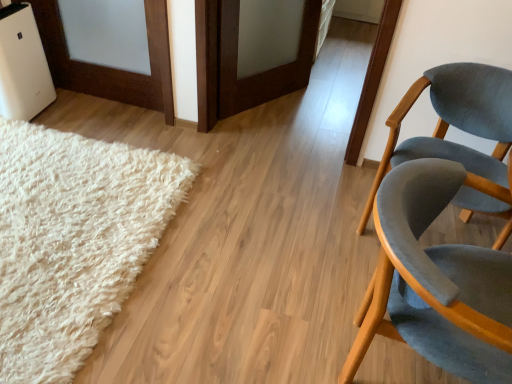
Question: From the image's perspective, does matte gray chair at right, the first chair when ordered from back to front, appear lower than velvet grey chair at right, which is the 1th chair in front-to-back order?

Choices:
 (A) no
 (B) yes

Answer: (A)

Question: Can you confirm if matte gray chair at right, placed as the 2th chair when sorted from front to back, is bigger than velvet grey chair at right, which is counted as the 2th chair, starting from the back?

Choices:
 (A) no
 (B) yes

Answer: (A)

Question: Is matte gray chair at right, placed as the 2th chair when sorted from front to back, facing towards velvet grey chair at right, which is counted as the 2th chair, starting from the back?

Choices:
 (A) no
 (B) yes

Answer: (B)

Question: Can you confirm if matte gray chair at right, placed as the 2th chair when sorted from front to back, is thinner than velvet grey chair at right, which is counted as the 2th chair, starting from the back?

Choices:
 (A) yes
 (B) no

Answer: (B)

Question: Is matte gray chair at right, placed as the 2th chair when sorted from front to back, smaller than velvet grey chair at right, which is the 1th chair in front-to-back order?

Choices:
 (A) yes
 (B) no

Answer: (A)

Question: Is matte gray chair at right, the first chair when ordered from back to front, taller than velvet grey chair at right, which is the 1th chair in front-to-back order?

Choices:
 (A) yes
 (B) no

Answer: (A)

Question: Is velvet grey chair at right, which is counted as the 2th chair, starting from the back, outside white fluffy rug at lower left?

Choices:
 (A) no
 (B) yes

Answer: (B)

Question: Is velvet grey chair at right, which is the 1th chair in front-to-back order, positioned behind white fluffy rug at lower left?

Choices:
 (A) no
 (B) yes

Answer: (A)

Question: Could you tell me if velvet grey chair at right, which is counted as the 2th chair, starting from the back, is facing white fluffy rug at lower left?

Choices:
 (A) no
 (B) yes

Answer: (A)

Question: Is white fluffy rug at lower left surrounded by velvet grey chair at right, which is the 1th chair in front-to-back order?

Choices:
 (A) yes
 (B) no

Answer: (B)

Question: Can you confirm if velvet grey chair at right, which is the 1th chair in front-to-back order, is taller than white fluffy rug at lower left?

Choices:
 (A) yes
 (B) no

Answer: (A)

Question: Is matte gray chair at right, placed as the 2th chair when sorted from front to back, oriented towards white fluffy rug at lower left?

Choices:
 (A) no
 (B) yes

Answer: (A)